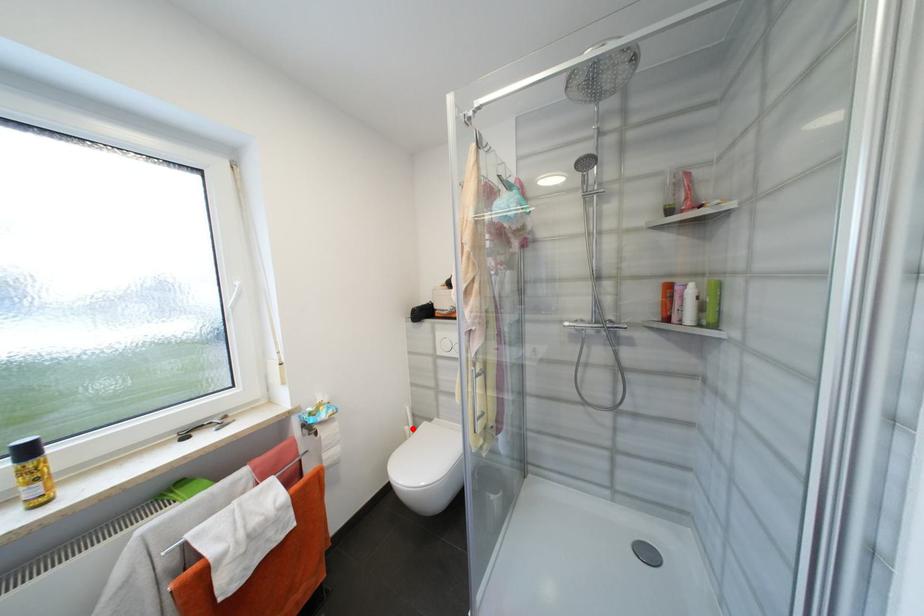
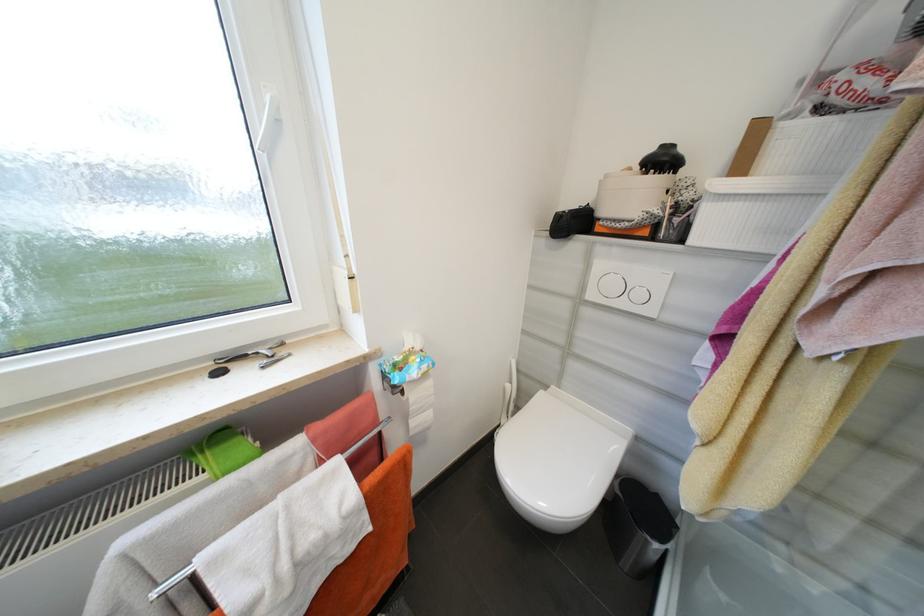
Find the pixel in the second image that matches the highlighted location in the first image.

(514, 387)